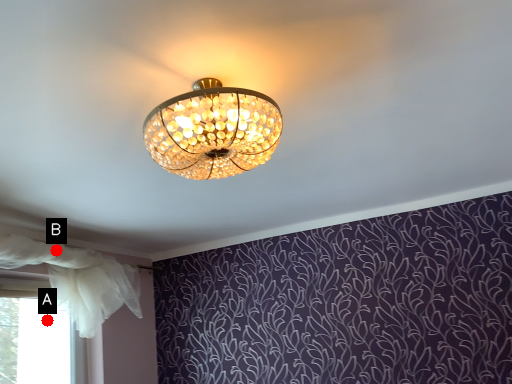
Question: Two points are circled on the image, labeled by A and B beside each circle. Which point appears closest to the camera in this image?

Choices:
 (A) A is closer
 (B) B is closer

Answer: (B)